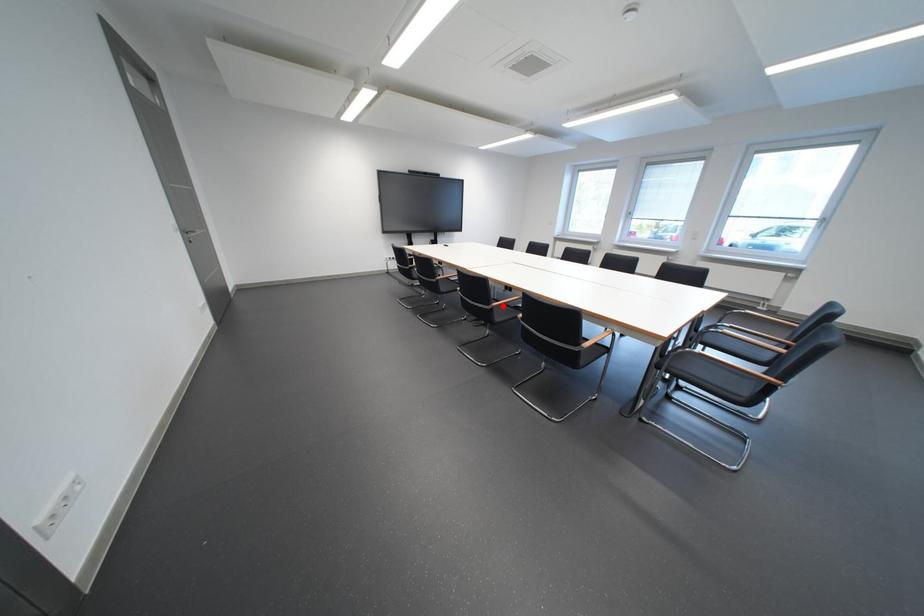
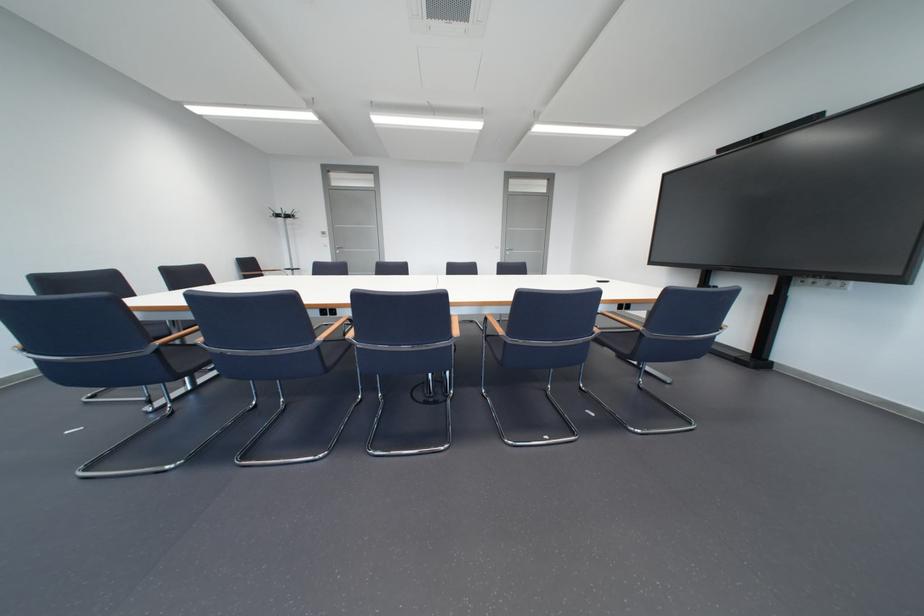
Question: I am providing you with two images of the same scene from different viewpoints. A red point is marked on the first image. Can you still see the location of the red point in image 2?

Choices:
 (A) Yes
 (B) No

Answer: (B)